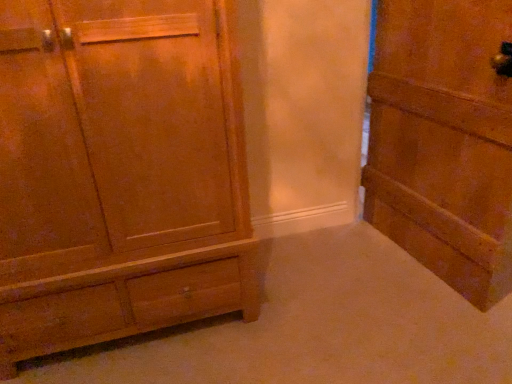
Question: Should I look upward or downward to see wooden cabinet at left?

Choices:
 (A) up
 (B) down

Answer: (A)

Question: Considering the relative sizes of wooden cabinet at left and wooden door at right in the image provided, is wooden cabinet at left wider than wooden door at right?

Choices:
 (A) no
 (B) yes

Answer: (B)

Question: Is wooden cabinet at left to the right of wooden door at right from the viewer's perspective?

Choices:
 (A) yes
 (B) no

Answer: (B)

Question: Is wooden door at right a part of wooden cabinet at left?

Choices:
 (A) yes
 (B) no

Answer: (B)

Question: From the image's perspective, is wooden cabinet at left located above wooden door at right?

Choices:
 (A) no
 (B) yes

Answer: (A)

Question: Is wooden door at right at the back of wooden cabinet at left?

Choices:
 (A) no
 (B) yes

Answer: (A)

Question: From a real-world perspective, is wooden cabinet at left positioned over wooden door at right based on gravity?

Choices:
 (A) no
 (B) yes

Answer: (B)

Question: Does wooden door at right have a smaller size compared to wooden cabinet at left?

Choices:
 (A) yes
 (B) no

Answer: (A)

Question: Is wooden cabinet at left a part of wooden door at right?

Choices:
 (A) yes
 (B) no

Answer: (B)

Question: Is wooden door at right positioned far away from wooden cabinet at left?

Choices:
 (A) no
 (B) yes

Answer: (B)

Question: Can you confirm if wooden door at right is taller than wooden cabinet at left?

Choices:
 (A) no
 (B) yes

Answer: (A)

Question: Can you confirm if wooden door at right is wider than wooden cabinet at left?

Choices:
 (A) yes
 (B) no

Answer: (B)

Question: Can you confirm if wooden door at right is positioned to the left of wooden cabinet at left?

Choices:
 (A) no
 (B) yes

Answer: (A)

Question: In terms of size, does wooden door at right appear bigger or smaller than wooden cabinet at left?

Choices:
 (A) small
 (B) big

Answer: (A)